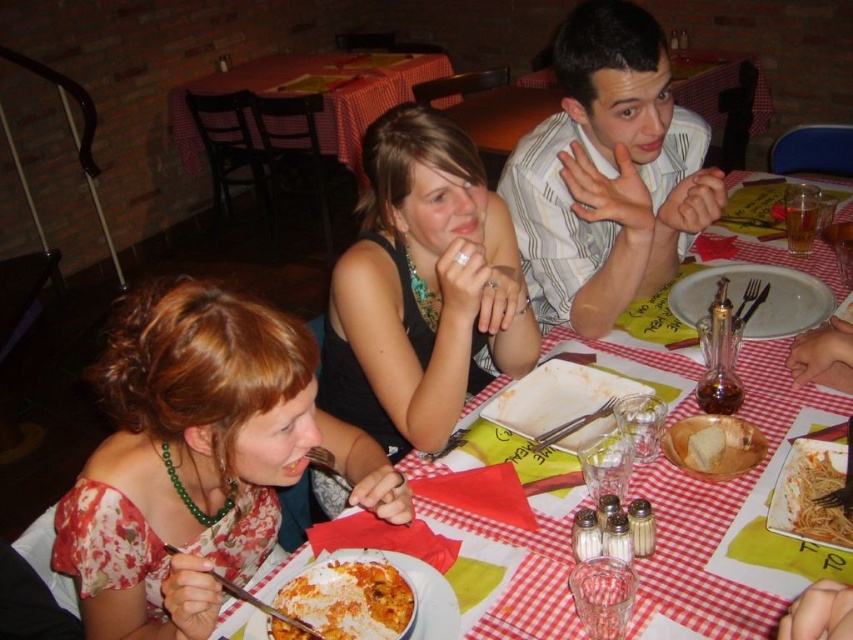
From the picture: You are a server at the restaurant and need to deliver a drink to the table. The drink must be placed on the checkered fabric table at center. However, there is a black matte dress at center in the way. Can you place the drink on the table without it being obstructed by the dress?

The black matte dress at center and checkered fabric table at center are 8.78 feet apart from each other, so there is enough space to place the drink on the checkered fabric table at center without obstruction from the dress.